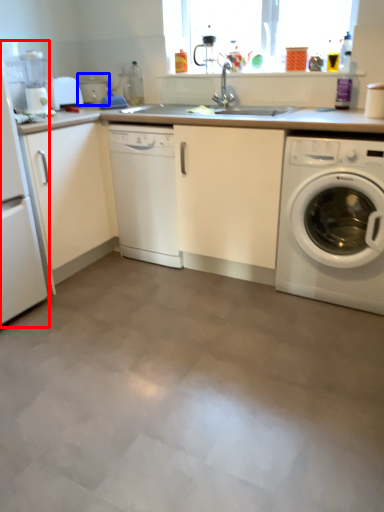
Question: Among these objects, which one is nearest to the camera, home appliance (highlighted by a red box) or appliance (highlighted by a blue box)?

Choices:
 (A) home appliance
 (B) appliance

Answer: (A)